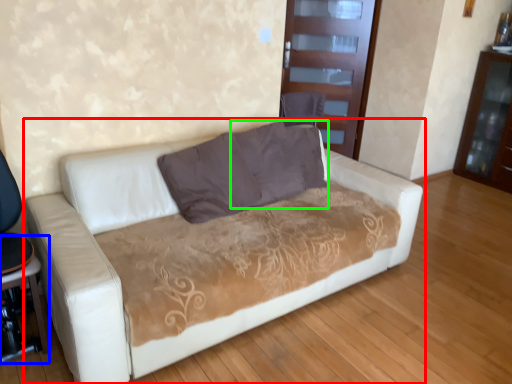
Question: Which is farther away from studio couch (highlighted by a red box)? table (highlighted by a blue box) or pillow (highlighted by a green box)?

Choices:
 (A) table
 (B) pillow

Answer: (A)